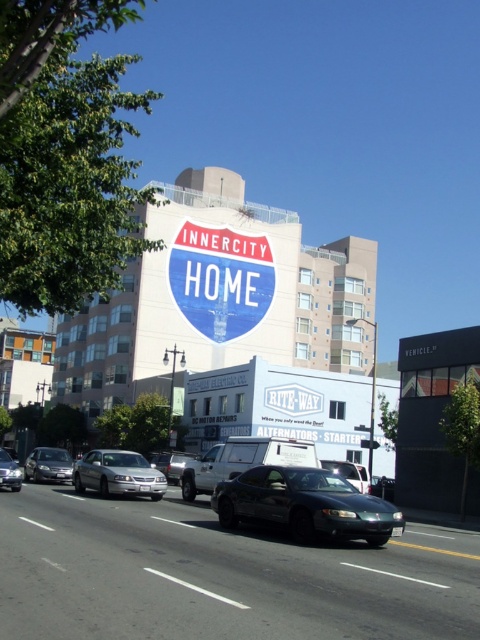
Is satin silver sedan at center to the left of shiny silver sedan at lower left from the viewer's perspective?

Incorrect, satin silver sedan at center is not on the left side of shiny silver sedan at lower left.

Can you confirm if satin silver sedan at center is positioned above shiny silver sedan at lower left?

Yes.

Is point (111, 481) farther from viewer compared to point (14, 468)?

No.

The height and width of the screenshot is (640, 480). I want to click on satin silver sedan at center, so pos(118,474).

Who is more forward, (291, 451) or (104, 492)?

Point (291, 451)

Describe the element at coordinates (242, 460) in the screenshot. I see `metallic silver truck at center` at that location.

Is point (215, 458) in front of point (132, 468)?

No, (215, 458) is behind (132, 468).

The image size is (480, 640). Find the location of `metallic silver truck at center`. metallic silver truck at center is located at coordinates 242,460.

What do you see at coordinates (242, 460) in the screenshot?
I see `metallic silver truck at center` at bounding box center [242, 460].

Is metallic silver truck at center below shiny silver sedan at lower left?

Yes.

Where is `metallic silver truck at center`? metallic silver truck at center is located at coordinates (242, 460).